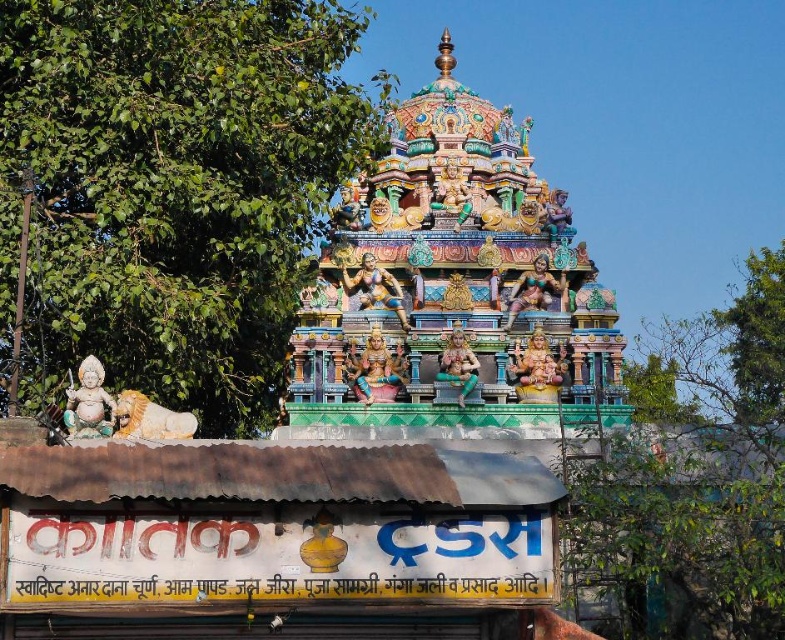
Question: Which object is the closest to the multicolored painted statue at center?

Choices:
 (A) green leafy tree at left
 (B) golden stone lion at left
 (C) polished bronze statue at center
 (D) stone statue at lower left

Answer: (C)

Question: Can you confirm if gold metallic statue at center is positioned to the left of polished gold statue at center?

Choices:
 (A) yes
 (B) no

Answer: (A)

Question: Among these objects, which one is farthest from the camera?

Choices:
 (A) polished bronze statue at center
 (B) polished gold statue at center
 (C) gold polished statue at center
 (D) green leafy tree at left

Answer: (A)

Question: Is polished bronze statue at center positioned behind matte gold statue at center?

Choices:
 (A) yes
 (B) no

Answer: (A)

Question: Is green leafy tree at left smaller than multicolored painted statue at center?

Choices:
 (A) yes
 (B) no

Answer: (B)

Question: Considering the real-world distances, which object is closest to the multicolored carved statue at center?

Choices:
 (A) green leafy tree at left
 (B) gold metallic statue at center
 (C) golden stone lion at left
 (D) polished gold statue at center

Answer: (D)